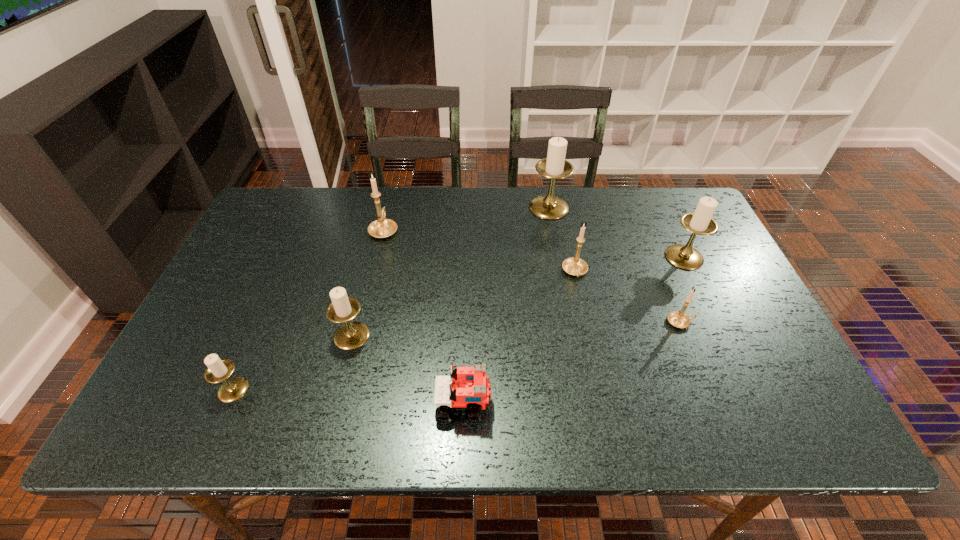
Locate an element on the screen. the tallest candle holder is located at coordinates (555, 166).

Where is `the farthest white candle holder`? Image resolution: width=960 pixels, height=540 pixels. the farthest white candle holder is located at coordinates (555, 166).

Identify the location of the biggest gold candle holder. (382, 228).

This screenshot has height=540, width=960. In order to click on the farthest gold candle holder in this screenshot , I will do pyautogui.click(x=382, y=228).

In order to click on the third smallest white candle holder in this screenshot , I will do `click(700, 222)`.

The height and width of the screenshot is (540, 960). In order to click on the rightmost white candle holder in this screenshot , I will do `click(700, 222)`.

This screenshot has height=540, width=960. In order to click on the second nearest gold candle holder in this screenshot , I will do `click(575, 266)`.

Find the location of a particular element. the second gold candle holder from right to left is located at coordinates (575, 266).

Find the location of a particular element. the third white candle holder from right to left is located at coordinates (351, 335).

Locate an element on the screen. This screenshot has width=960, height=540. the third farthest white candle holder is located at coordinates pos(351,335).